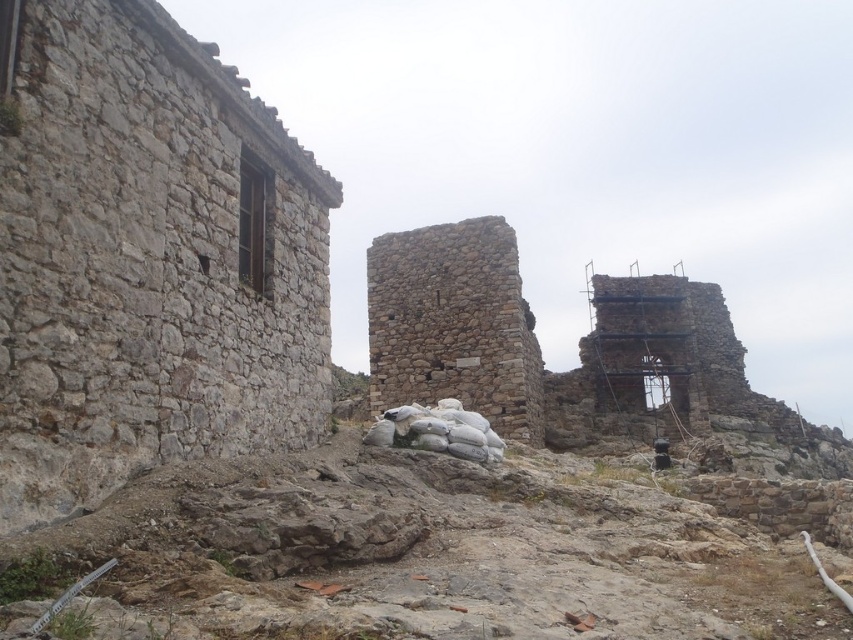
Based on the scene description, where is the rough stone wall at left located in terms of its 2D coordinates?

The rough stone wall at left is located at the 2D coordinates of point (148, 259).

You are an architect visiting an old stone structure. You notice the rough stone wall at left and the rustic stone ruins at center. Which one is closer to your current position?

The rough stone wall at left is closer to your current position because it is in front of the rustic stone ruins at center.